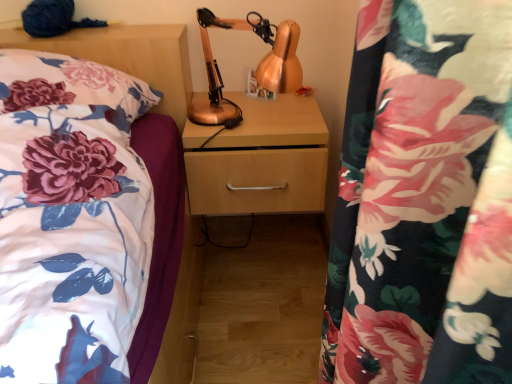
Image resolution: width=512 pixels, height=384 pixels. Identify the location of free space above wooden drawer at center (from a real-world perspective). (259, 115).